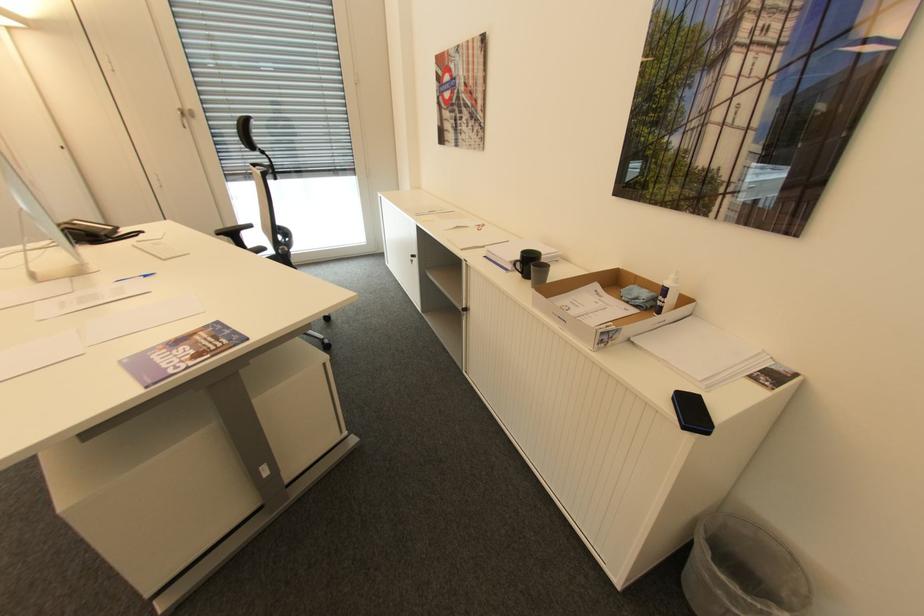
This screenshot has width=924, height=616. Find the location of `black smartphone`. black smartphone is located at coordinates (691, 411).